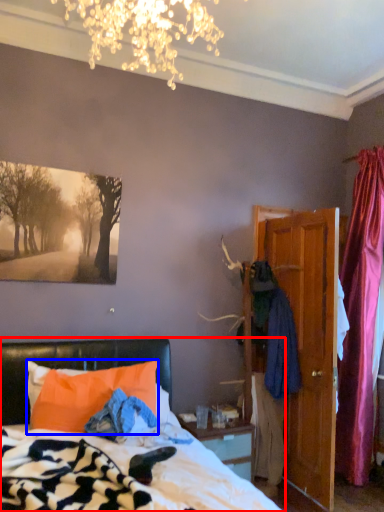
Question: Which object is further to the camera taking this photo, bed (highlighted by a red box) or pillow (highlighted by a blue box)?

Choices:
 (A) bed
 (B) pillow

Answer: (B)